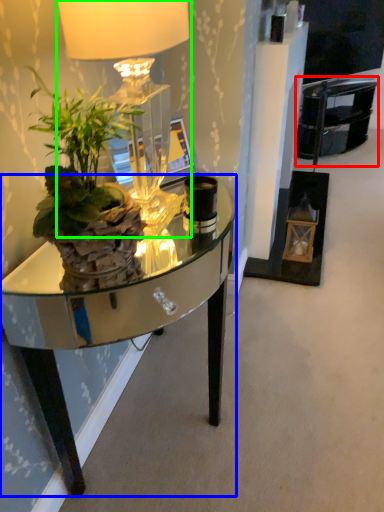
Question: Which is farther away from armchair (highlighted by a red box)? desk (highlighted by a blue box) or lamp (highlighted by a green box)?

Choices:
 (A) desk
 (B) lamp

Answer: (A)